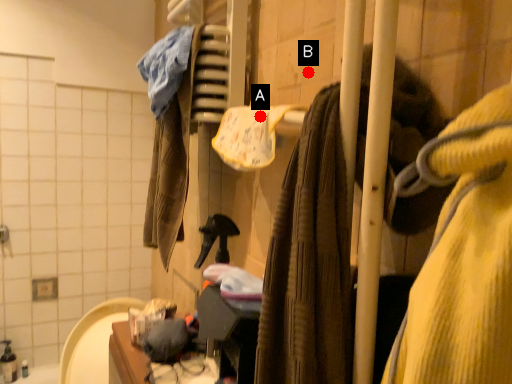
Question: Two points are circled on the image, labeled by A and B beside each circle. Which point is farther to the camera?

Choices:
 (A) A is further
 (B) B is further

Answer: (A)